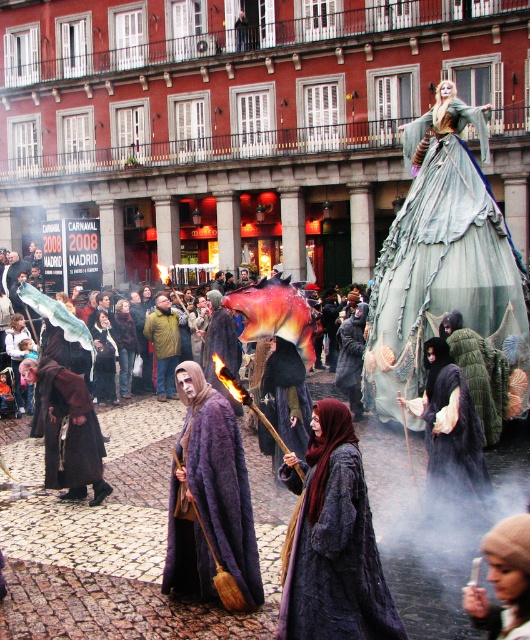
Can you confirm if green sheer dress at upper right is positioned to the right of fuzzy dark cloak at center?

No, green sheer dress at upper right is not to the right of fuzzy dark cloak at center.

Can you confirm if green sheer dress at upper right is taller than fuzzy dark cloak at center?

Yes.

Image resolution: width=530 pixels, height=640 pixels. What do you see at coordinates (441, 259) in the screenshot?
I see `green sheer dress at upper right` at bounding box center [441, 259].

Find the location of `green sheer dress at upper right`. green sheer dress at upper right is located at coordinates (441, 259).

Which is behind, point (82, 404) or point (490, 433)?

The point (490, 433) is more distant.

Can you confirm if brown woolen robe at center is wider than fuzzy dark cloak at center?

Correct, the width of brown woolen robe at center exceeds that of fuzzy dark cloak at center.

Image resolution: width=530 pixels, height=640 pixels. Identify the location of brown woolen robe at center. (68, 432).

Which is behind, point (465, 148) or point (80, 486)?

The point (465, 148) is behind.

Who is higher up, green sheer dress at upper right or brown woolen robe at center?

green sheer dress at upper right

Between point (408, 356) and point (61, 378), which one is positioned in front?

Point (61, 378) is in front.

Where is `green sheer dress at upper right`? green sheer dress at upper right is located at coordinates (441, 259).